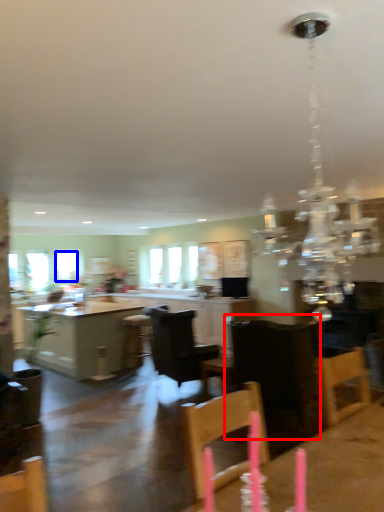
Question: Which object is closer to the camera taking this photo, chair (highlighted by a red box) or window (highlighted by a blue box)?

Choices:
 (A) chair
 (B) window

Answer: (A)